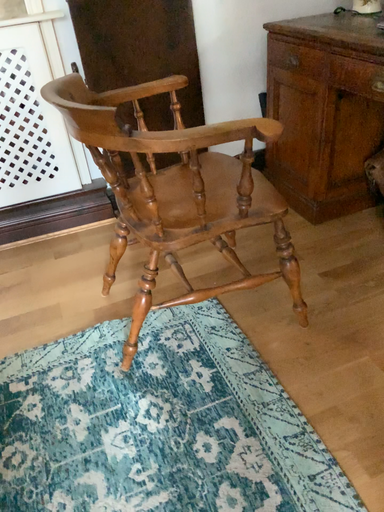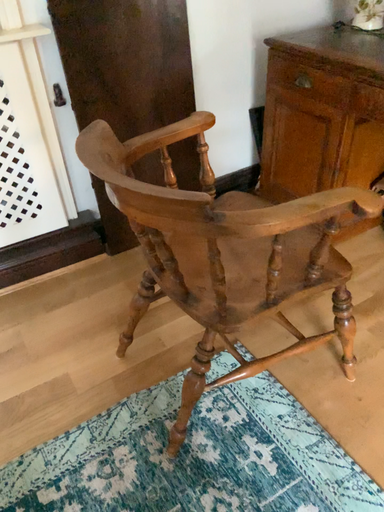
Question: How did the camera likely rotate when shooting the video?

Choices:
 (A) rotated right
 (B) rotated left

Answer: (A)